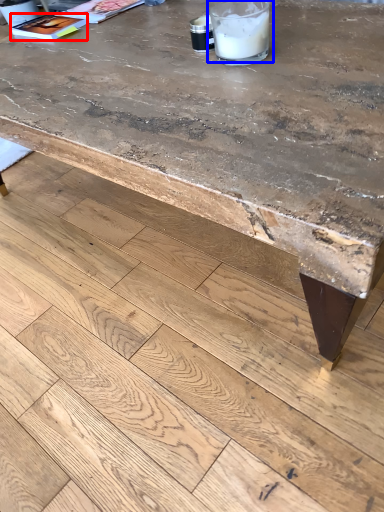
Question: Which object appears farthest to the camera in this image, magazine (highlighted by a red box) or drinking straw (highlighted by a blue box)?

Choices:
 (A) magazine
 (B) drinking straw

Answer: (A)